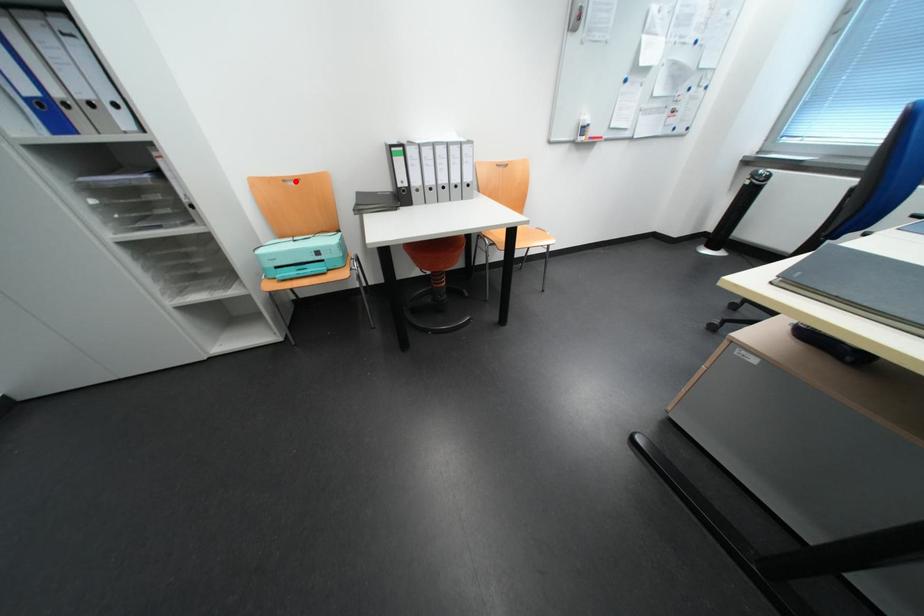
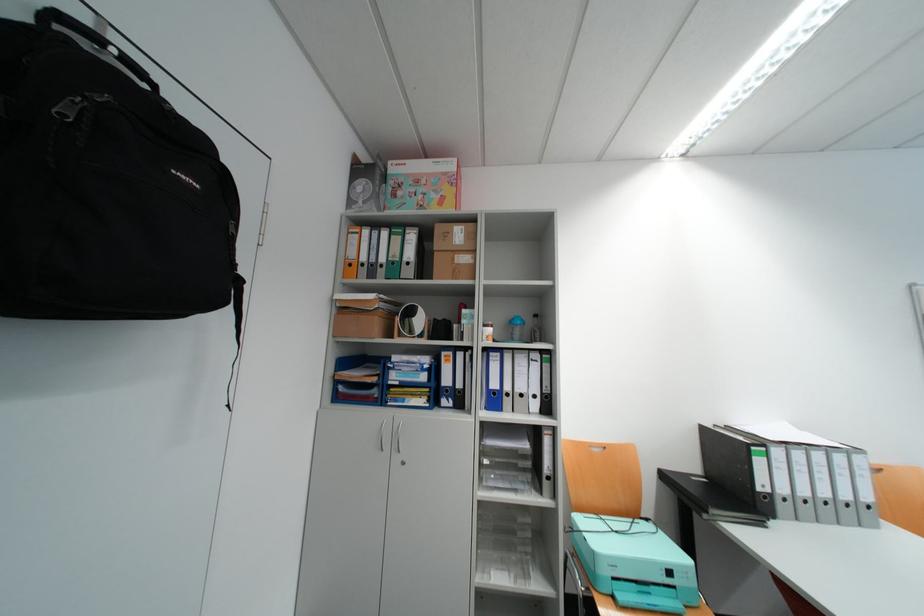
Question: I am providing you with two images of the same scene from different viewpoints. In image1, a red point is highlighted. Considering the same 3D point in image2, which of the following is correct?

Choices:
 (A) It is closer
 (B) It is farther

Answer: (B)